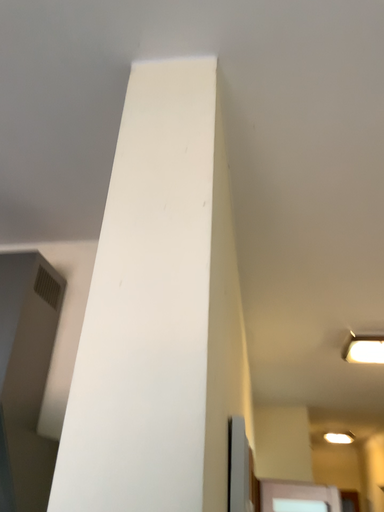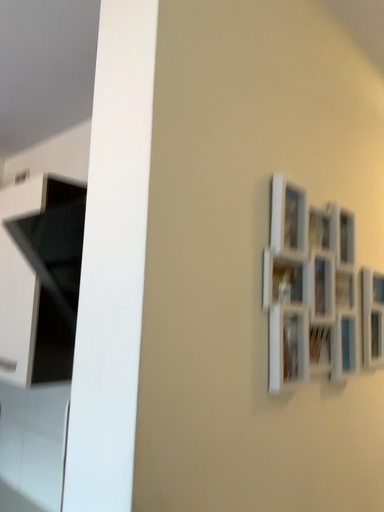
Question: Which way did the camera rotate in the video?

Choices:
 (A) rotated right
 (B) rotated left

Answer: (B)